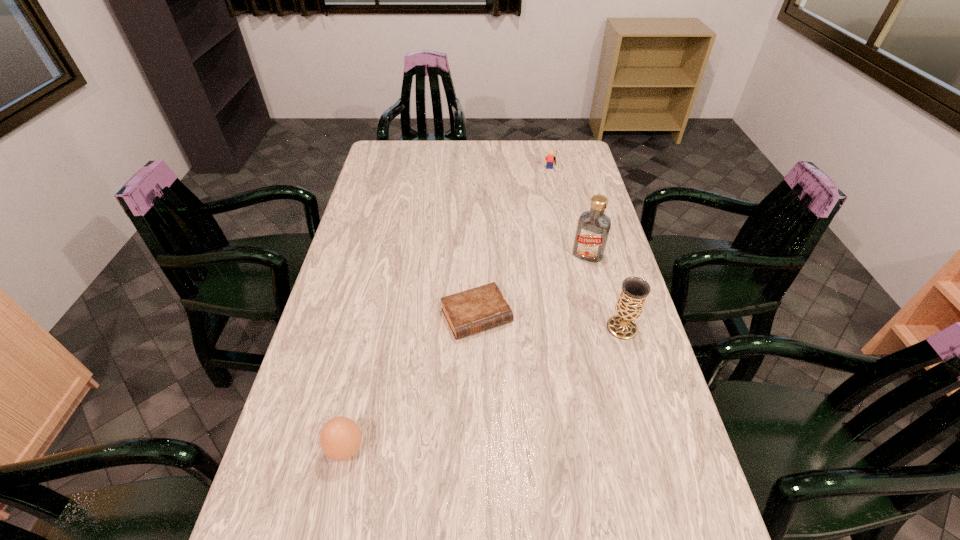
Where is `object situated at the left edge`? object situated at the left edge is located at coordinates (340, 438).

The height and width of the screenshot is (540, 960). Find the location of `chalice that is at the right edge`. chalice that is at the right edge is located at coordinates (634, 291).

Image resolution: width=960 pixels, height=540 pixels. Find the location of `vodka that is at the right edge`. vodka that is at the right edge is located at coordinates tap(593, 227).

Find the location of a particular element. Lego at the right edge is located at coordinates [x=550, y=158].

Where is `object situated at the far right corner`? This screenshot has height=540, width=960. object situated at the far right corner is located at coordinates (550, 158).

In the image, there is a desktop. Where is `free space at the far edge`? free space at the far edge is located at coordinates (451, 142).

Identify the location of vacant space at the near edge of the desktop. The width and height of the screenshot is (960, 540). (476, 527).

Where is `vacant space at the left edge`? Image resolution: width=960 pixels, height=540 pixels. vacant space at the left edge is located at coordinates (351, 314).

Identify the location of vacant space at the right edge of the desktop. The height and width of the screenshot is (540, 960). (576, 212).

This screenshot has height=540, width=960. Find the location of `free point at the far left corner`. free point at the far left corner is located at coordinates (412, 156).